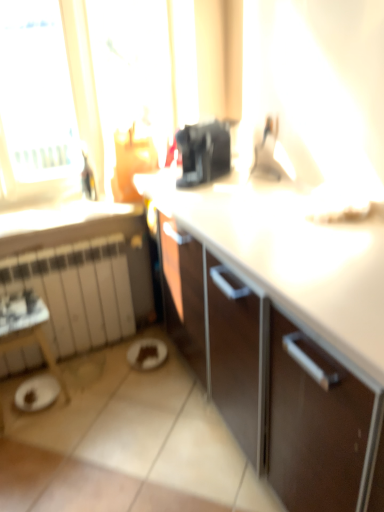
You are a GUI agent. You are given a task and a screenshot of the screen. Output one action in this format:
    pyautogui.click(x=<x>, y=<y>)
    Task: Click on the brown matte plate at lower center
    The width and height of the screenshot is (384, 512).
    Given the screenshot: What is the action you would take?
    pyautogui.click(x=147, y=354)

Describe the element at coordinates (147, 354) in the screenshot. I see `brown matte plate at lower center` at that location.

The image size is (384, 512). What do you see at coordinates (77, 291) in the screenshot? I see `white matte radiator at lower left` at bounding box center [77, 291].

The width and height of the screenshot is (384, 512). In order to click on white matte radiator at lower left in this screenshot , I will do `click(77, 291)`.

The width and height of the screenshot is (384, 512). I want to click on brown matte plate at lower center, so click(147, 354).

Between brown matte plate at lower center and white matte radiator at lower left, which one appears on the left side from the viewer's perspective?

From the viewer's perspective, white matte radiator at lower left appears more on the left side.

Which object is further away from the camera taking this photo, brown matte plate at lower center or white matte radiator at lower left?

brown matte plate at lower center is more distant.

Based on the photo, which point is more distant from viewer, (x=132, y=350) or (x=79, y=260)?

The point (x=132, y=350) is farther from the camera.

From the image's perspective, is brown matte plate at lower center on white matte radiator at lower left?

No, from the image's perspective, brown matte plate at lower center is not on top of white matte radiator at lower left.

From a real-world perspective, is brown matte plate at lower center positioned under white matte radiator at lower left based on gravity?

Indeed, from a real-world perspective, brown matte plate at lower center is positioned beneath white matte radiator at lower left.

Which of these two, brown matte plate at lower center or white matte radiator at lower left, is wider?

brown matte plate at lower center.

Considering the sizes of brown matte plate at lower center and white matte radiator at lower left in the image, is brown matte plate at lower center taller or shorter than white matte radiator at lower left?

brown matte plate at lower center is shorter than white matte radiator at lower left.

Is brown matte plate at lower center smaller than white matte radiator at lower left?

Correct, brown matte plate at lower center occupies less space than white matte radiator at lower left.

Would you say brown matte plate at lower center is outside white matte radiator at lower left?

Absolutely, brown matte plate at lower center is external to white matte radiator at lower left.

Is brown matte plate at lower center beside white matte radiator at lower left?

No, brown matte plate at lower center is not with white matte radiator at lower left.

Could you tell me if brown matte plate at lower center is facing white matte radiator at lower left?

No, brown matte plate at lower center is not facing towards white matte radiator at lower left.

How many degrees apart are the facing directions of brown matte plate at lower center and white matte radiator at lower left?

The facing directions of brown matte plate at lower center and white matte radiator at lower left are 2.75 degrees apart.

This screenshot has width=384, height=512. Find the location of `manhole on the right of white matte radiator at lower left`. manhole on the right of white matte radiator at lower left is located at coordinates (147, 354).

Can you confirm if white matte radiator at lower left is positioned to the left of brown matte plate at lower center?

Indeed, white matte radiator at lower left is positioned on the left side of brown matte plate at lower center.

In the image, is white matte radiator at lower left positioned in front of or behind brown matte plate at lower center?

white matte radiator at lower left is in front of brown matte plate at lower center.

Which is behind, point (115, 297) or point (148, 351)?

The point (115, 297) is behind.

From the image's perspective, does white matte radiator at lower left appear lower than brown matte plate at lower center?

No.

From a real-world perspective, is white matte radiator at lower left above or below brown matte plate at lower center?

white matte radiator at lower left is situated higher than brown matte plate at lower center in the real world.

Considering the sizes of objects white matte radiator at lower left and brown matte plate at lower center in the image provided, who is thinner, white matte radiator at lower left or brown matte plate at lower center?

With smaller width is white matte radiator at lower left.

Considering the sizes of objects white matte radiator at lower left and brown matte plate at lower center in the image provided, who is taller, white matte radiator at lower left or brown matte plate at lower center?

With more height is white matte radiator at lower left.

Considering the sizes of white matte radiator at lower left and brown matte plate at lower center in the image, is white matte radiator at lower left bigger or smaller than brown matte plate at lower center?

In the image, white matte radiator at lower left appears to be larger than brown matte plate at lower center.

In the scene shown: Would you say white matte radiator at lower left is outside brown matte plate at lower center?

Yes, white matte radiator at lower left is outside of brown matte plate at lower center.

Is white matte radiator at lower left not near brown matte plate at lower center?

That's not correct — white matte radiator at lower left is a little close to brown matte plate at lower center.

Does white matte radiator at lower left turn towards brown matte plate at lower center?

Yes.

What's the angular difference between white matte radiator at lower left and brown matte plate at lower center's facing directions?

The angle between the facing direction of white matte radiator at lower left and the facing direction of brown matte plate at lower center is 2.75 degrees.

You are a GUI agent. You are given a task and a screenshot of the screen. Output one action in this format:
    pyautogui.click(x=<x>, y=<y>)
    Task: Click on the radiator on the left of brown matte plate at lower center
    The image size is (384, 512).
    Given the screenshot: What is the action you would take?
    pyautogui.click(x=77, y=291)

Locate an element on the screen. manhole that appears below the white matte radiator at lower left (from a real-world perspective) is located at coordinates (147, 354).

In the image, there is a white matte radiator at lower left. Where is `manhole below it (from the image's perspective)`? Image resolution: width=384 pixels, height=512 pixels. manhole below it (from the image's perspective) is located at coordinates (147, 354).